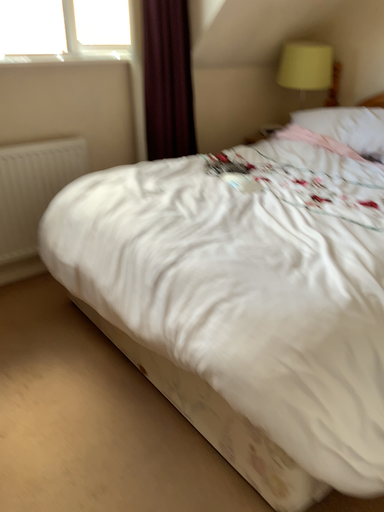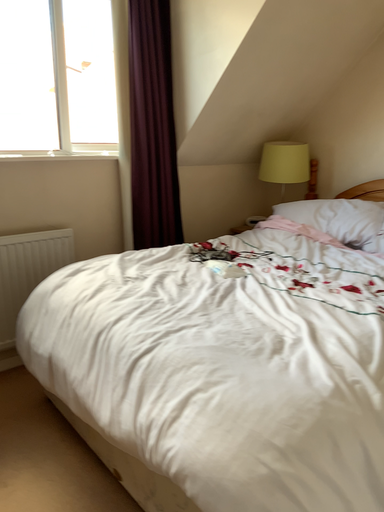
Question: How did the camera likely rotate when shooting the video?

Choices:
 (A) rotated downward
 (B) rotated upward

Answer: (B)